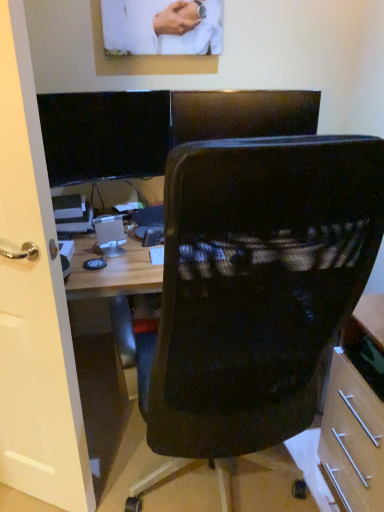
Describe the element at coordinates (256, 287) in the screenshot. I see `black mesh chair at center` at that location.

I want to click on white glossy door at left, so click(34, 302).

The height and width of the screenshot is (512, 384). What do you see at coordinates (104, 135) in the screenshot?
I see `black glossy monitor at upper left` at bounding box center [104, 135].

Consider the image. In order to face black glossy monitor at upper left, should I rotate leftwards or rightwards?

A 11.013 degree turn to the left will do.

I want to click on black mesh chair at center, so click(256, 287).

Is black mesh chair at center turned away from white glossy door at left?

No.

Between point (192, 373) and point (49, 364), which one is positioned behind?

The point (49, 364) is farther from the camera.

How different are the orientations of black mesh chair at center and white glossy door at left in degrees?

There is a 147-degree angle between the facing directions of black mesh chair at center and white glossy door at left.

From the image's perspective, between white glossy door at left and black glossy monitor at upper left, which one is located above?

black glossy monitor at upper left is shown above in the image.

Which of these two, white glossy door at left or black glossy monitor at upper left, is thinner?

black glossy monitor at upper left is thinner.

Does point (27, 330) lie behind point (116, 152)?

That is False.

Which object is positioned more to the left, white glossy door at left or black glossy monitor at upper left?

white glossy door at left.

Is white glossy door at left shorter than black mesh chair at center?

Incorrect, the height of white glossy door at left does not fall short of that of black mesh chair at center.

Which is in front, white glossy door at left or black mesh chair at center?

black mesh chair at center.

Does point (32, 112) appear closer or farther from the camera than point (351, 223)?

Point (32, 112) is farther from the camera than point (351, 223).

Between black glossy monitor at upper left and white glossy door at left, which one has smaller size?

With smaller size is black glossy monitor at upper left.

Which is in front, black glossy monitor at upper left or white glossy door at left?

white glossy door at left is closer to the camera.

Are black glossy monitor at upper left and white glossy door at left far apart?

No, black glossy monitor at upper left is in close proximity to white glossy door at left.

Is point (102, 142) behind point (16, 360)?

Yes, point (102, 142) is farther from viewer.

At what (x,y) coordinates should I click in order to perform the action: click on chair located underneath the black glossy monitor at upper left (from a real-world perspective). Please return your answer as a coordinate pair (x, y). This screenshot has width=384, height=512. Looking at the image, I should click on (256, 287).

Which object is more forward, black mesh chair at center or black glossy monitor at upper left?

black mesh chair at center is more forward.

Is point (280, 164) more distant than point (102, 178)?

No.

Is black glossy monitor at upper left spatially inside black mesh chair at center, or outside of it?

black glossy monitor at upper left cannot be found inside black mesh chair at center.

Does black glossy monitor at upper left have a greater height compared to black mesh chair at center?

No.

From a real-world perspective, which is physically below, black glossy monitor at upper left or black mesh chair at center?

From a 3D spatial view, black mesh chair at center is below.

Could you tell me if black glossy monitor at upper left is facing black mesh chair at center?

Yes, black glossy monitor at upper left is facing black mesh chair at center.

Identify the location of chair in front of the white glossy door at left. (256, 287).

At what (x,y) coordinates should I click in order to perform the action: click on glass door on the left of black glossy monitor at upper left. Please return your answer as a coordinate pair (x, y). Looking at the image, I should click on (34, 302).

Estimate the real-world distances between objects in this image. Which object is closer to black glossy monitor at upper left, white glossy door at left or black mesh chair at center?

white glossy door at left.

Looking at this image, estimate the real-world distances between objects in this image. Which object is closer to white glossy door at left, black mesh chair at center or black glossy monitor at upper left?

black mesh chair at center is closer to white glossy door at left.

Estimate the real-world distances between objects in this image. Which object is closer to black glossy monitor at upper left, black mesh chair at center or white glossy door at left?

white glossy door at left.

Looking at the image, which one is located further to black mesh chair at center, black glossy monitor at upper left or white glossy door at left?

The object further to black mesh chair at center is black glossy monitor at upper left.

Considering their positions, is white glossy door at left positioned further to black mesh chair at center than black glossy monitor at upper left?

black glossy monitor at upper left is positioned further to the anchor black mesh chair at center.

When comparing their distances from white glossy door at left, does black glossy monitor at upper left or black mesh chair at center seem further?

black glossy monitor at upper left is positioned further to the anchor white glossy door at left.

Locate an element on the screen. Image resolution: width=384 pixels, height=512 pixels. glass door between black mesh chair at center and black glossy monitor at upper left along the z-axis is located at coordinates (34, 302).